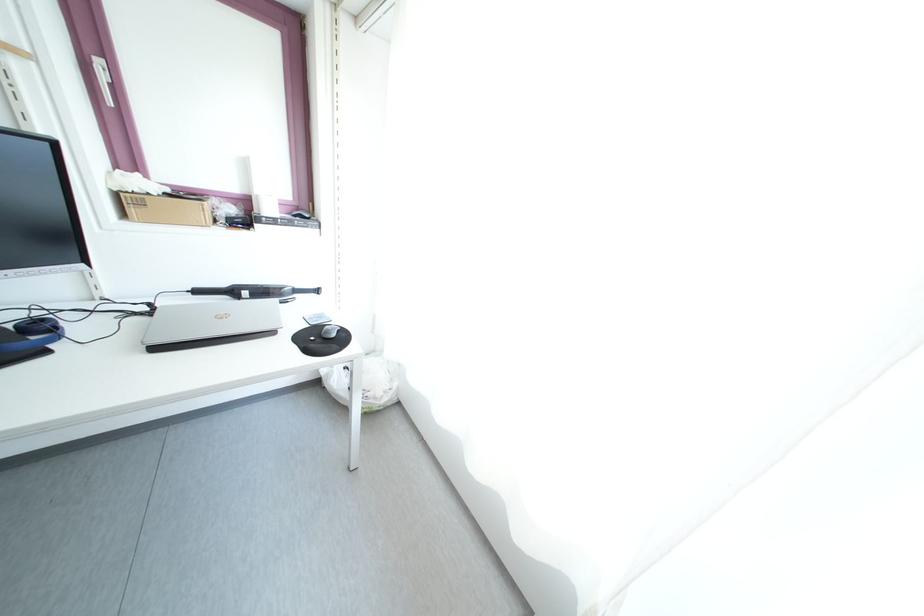
At what (x,y) coordinates should I click in order to perform the action: click on white trash bag. Please return your answer as a coordinate pair (x, y). Looking at the image, I should click on (365, 382).